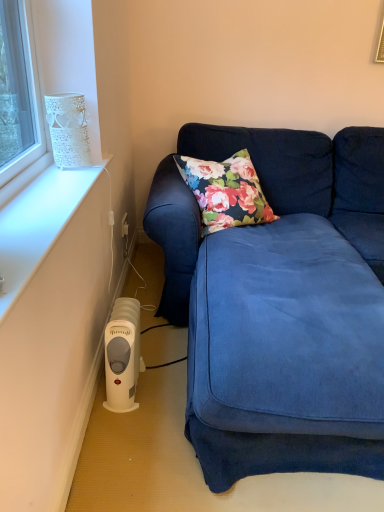
Question: Based on their positions, is white plastic heater at lower left located to the left or right of velvet blue couch at lower right?

Choices:
 (A) left
 (B) right

Answer: (A)

Question: Considering the positions of white plastic heater at lower left and velvet blue couch at lower right in the image, is white plastic heater at lower left taller or shorter than velvet blue couch at lower right?

Choices:
 (A) short
 (B) tall

Answer: (A)

Question: Which of these objects is positioned farthest from the white textured vase at upper left?

Choices:
 (A) velvet blue couch at lower right
 (B) white plastic heater at lower left

Answer: (A)

Question: Which object is the closest to the white textured vase at upper left?

Choices:
 (A) white plastic heater at lower left
 (B) velvet blue couch at lower right

Answer: (A)